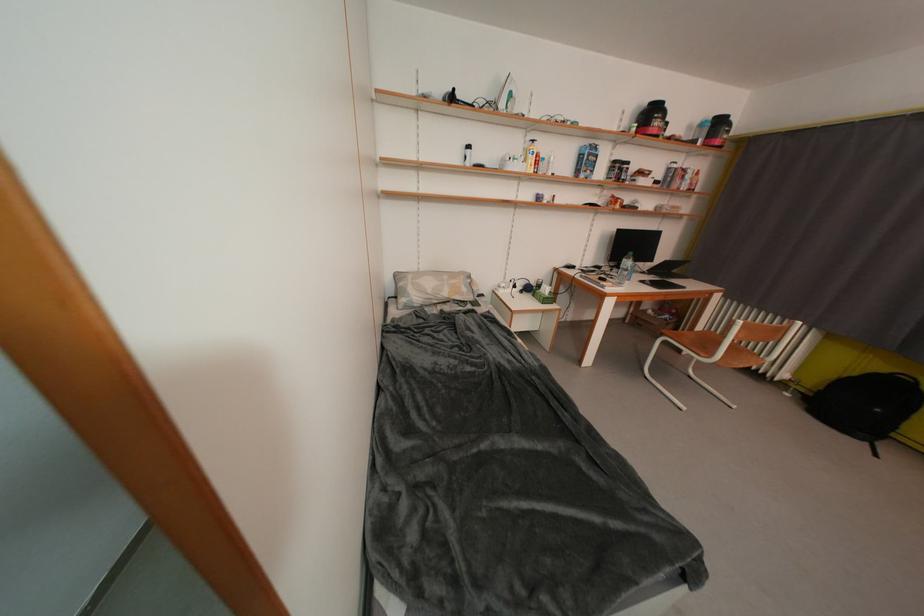
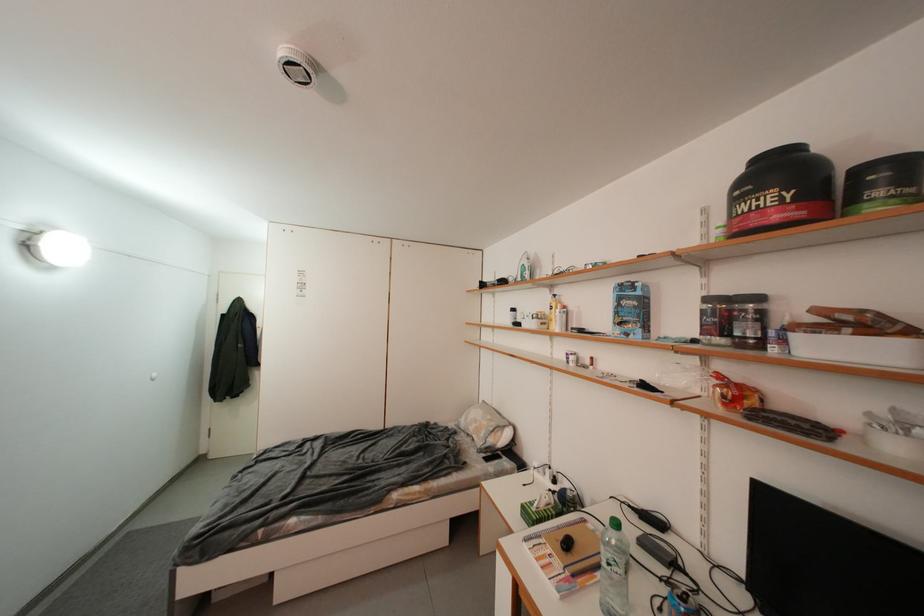
Find the pixel in the second image that matches the point at 669,127 in the first image.

(776, 201)